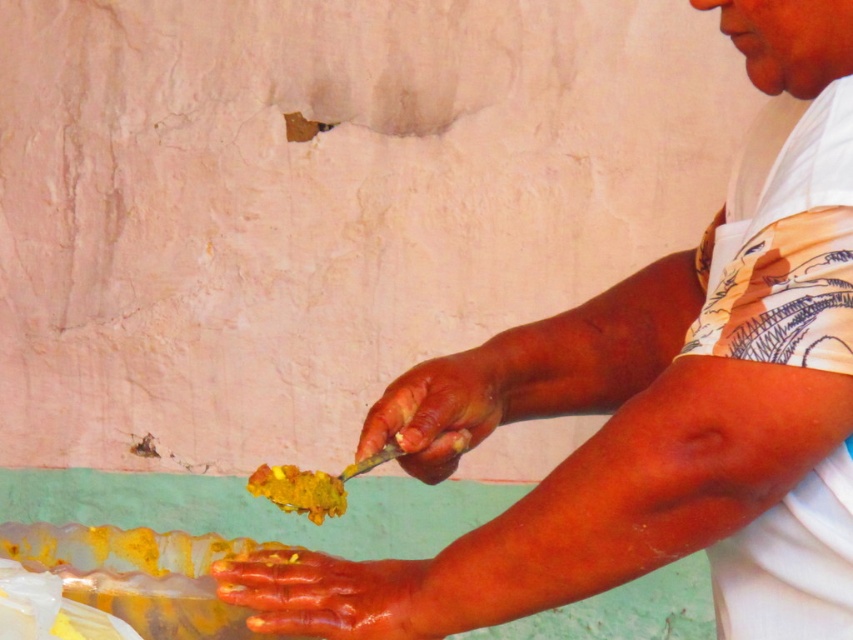
You are holding a yellowish matte paintbrush at center and want to reach a paint can that is 1.5 meters away from you. Can you reach it without moving your feet?

The yellowish matte paintbrush at center is 1.32 meters away from the viewer. Since the paint can is 1.5 meters away, which is farther than the distance to the paintbrush, you cannot reach it without moving your feet.